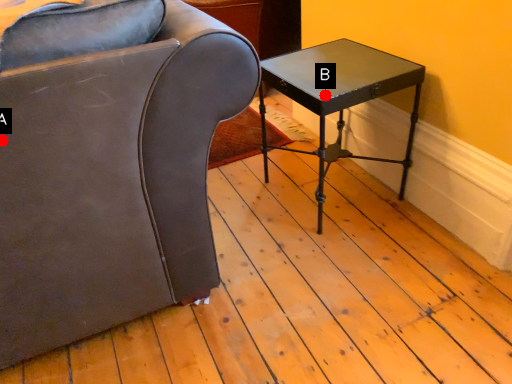
Question: Two points are circled on the image, labeled by A and B beside each circle. Which point is farther from the camera taking this photo?

Choices:
 (A) A is further
 (B) B is further

Answer: (B)